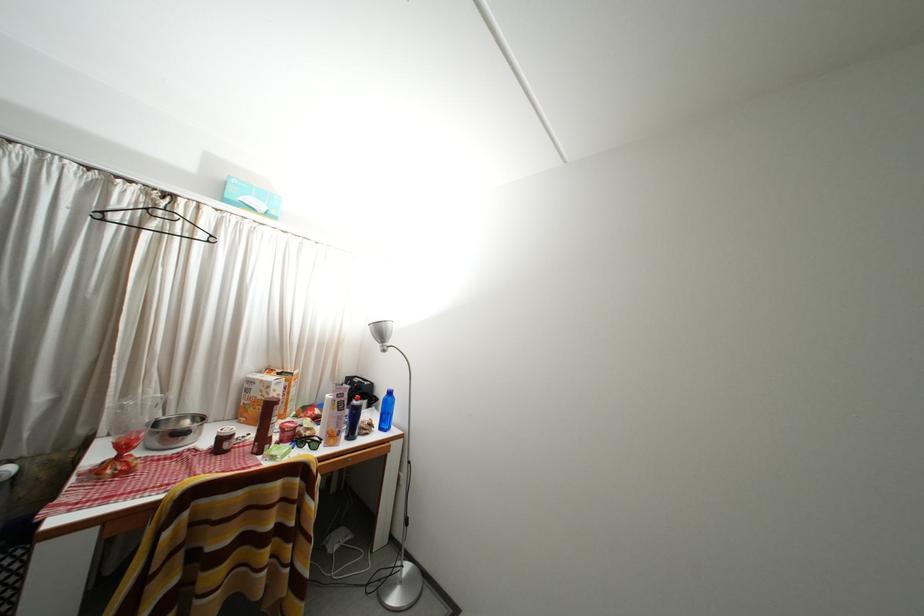
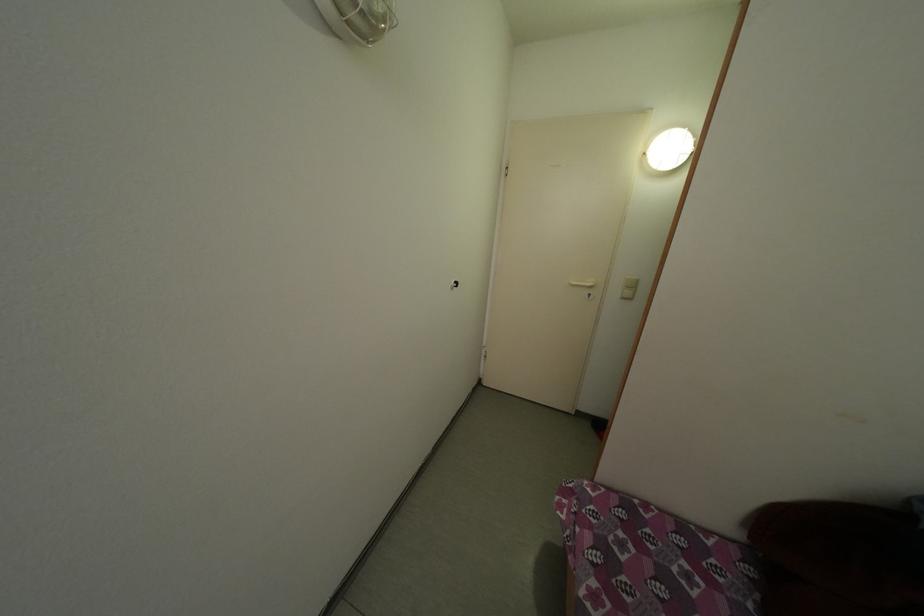
Based on the continuous images, in which direction is the camera rotating?

The rotation direction of the camera is right-down.